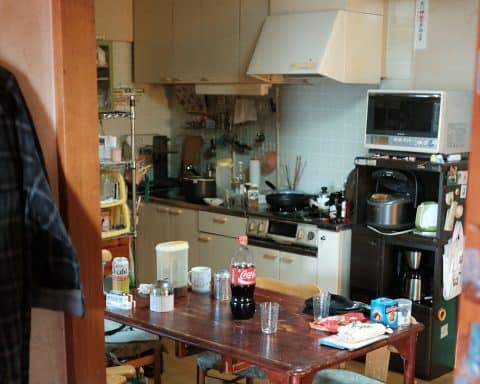
In order to click on cabinets in this screenshot , I will do `click(208, 43)`.